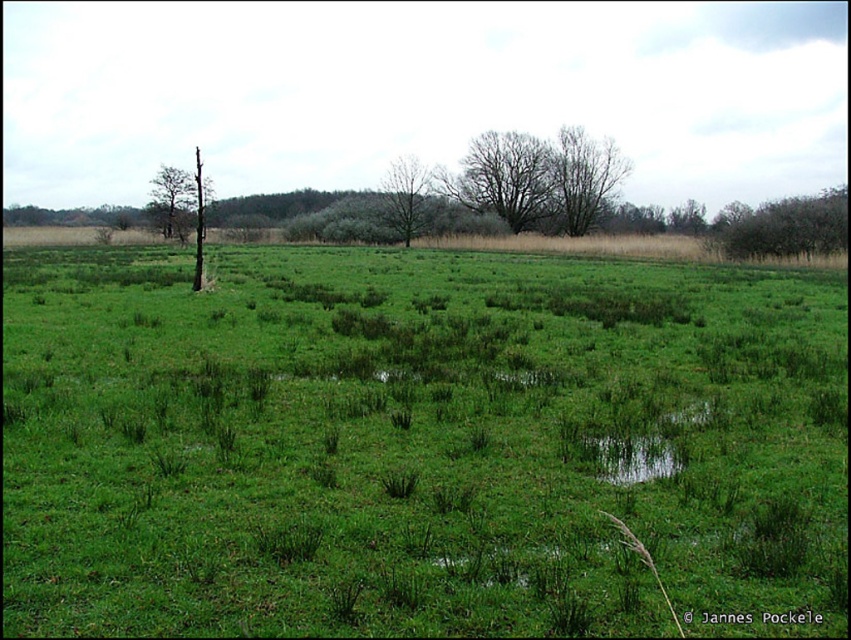
Question: Which point is closer to the camera?

Choices:
 (A) green grassy at center
 (B) bare tree at center

Answer: (A)

Question: Can you confirm if bare branches at center is positioned above bare tree at center?

Choices:
 (A) yes
 (B) no

Answer: (A)

Question: Which of the following is the farthest from the observer?

Choices:
 (A) (x=557, y=163)
 (B) (x=413, y=184)
 (C) (x=821, y=227)

Answer: (A)

Question: Which point appears closest to the camera in this image?

Choices:
 (A) (153, 192)
 (B) (812, 227)
 (C) (398, 163)
 (D) (615, 152)

Answer: (B)

Question: Is bare branches at center thinner than green leafy tree at upper left?

Choices:
 (A) no
 (B) yes

Answer: (B)

Question: From the image, what is the correct spatial relationship of bare branches at center in relation to dark green textured tree at upper right?

Choices:
 (A) below
 (B) above

Answer: (B)